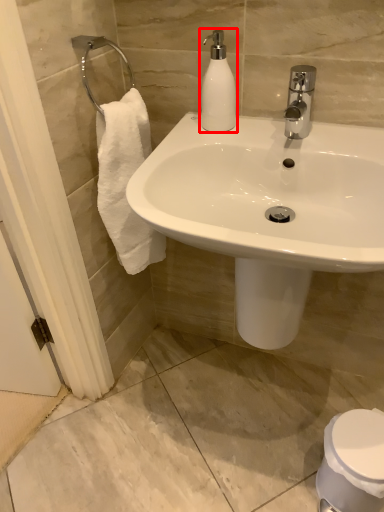
Question: Considering the relative positions of soap dispenser (annotated by the red box) and toilet in the image provided, where is soap dispenser (annotated by the red box) located with respect to the staircase?

Choices:
 (A) right
 (B) left

Answer: (B)